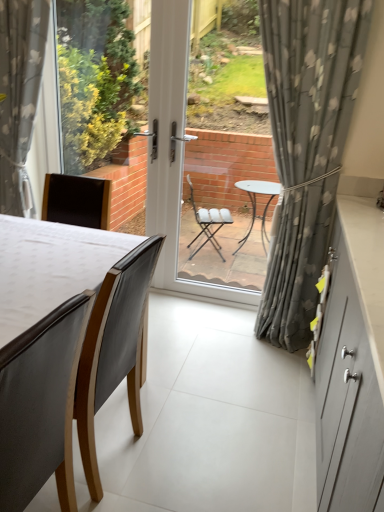
Where is `free spot in front of transparent glass door at center`? The height and width of the screenshot is (512, 384). free spot in front of transparent glass door at center is located at coordinates (224, 334).